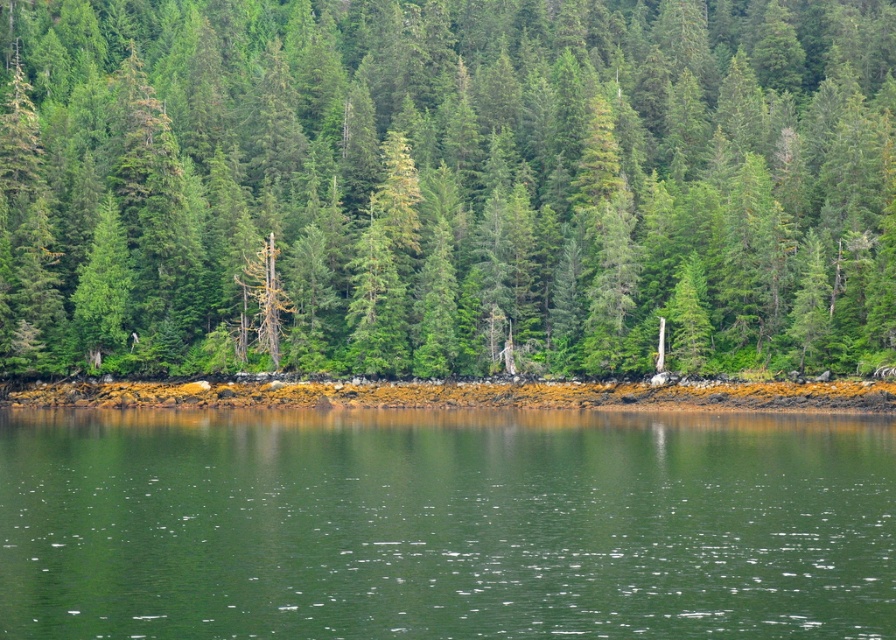
Question: Considering the real-world distances, which object is farthest from the green smooth water at center?

Choices:
 (A) green matte tree at center
 (B) brown mossy rocks at lower center

Answer: (A)

Question: Estimate the real-world distances between objects in this image. Which object is farther from the brown mossy rocks at lower center?

Choices:
 (A) green smooth water at center
 (B) green matte tree at center

Answer: (B)

Question: Is green smooth water at center closer to the viewer compared to brown mossy rocks at lower center?

Choices:
 (A) yes
 (B) no

Answer: (A)

Question: Can you confirm if green matte tree at center is positioned to the left of brown mossy rocks at lower center?

Choices:
 (A) no
 (B) yes

Answer: (A)

Question: Considering the real-world distances, which object is farthest from the green smooth water at center?

Choices:
 (A) brown mossy rocks at lower center
 (B) green matte tree at center

Answer: (B)

Question: Does green matte tree at center have a greater width compared to green smooth water at center?

Choices:
 (A) yes
 (B) no

Answer: (A)